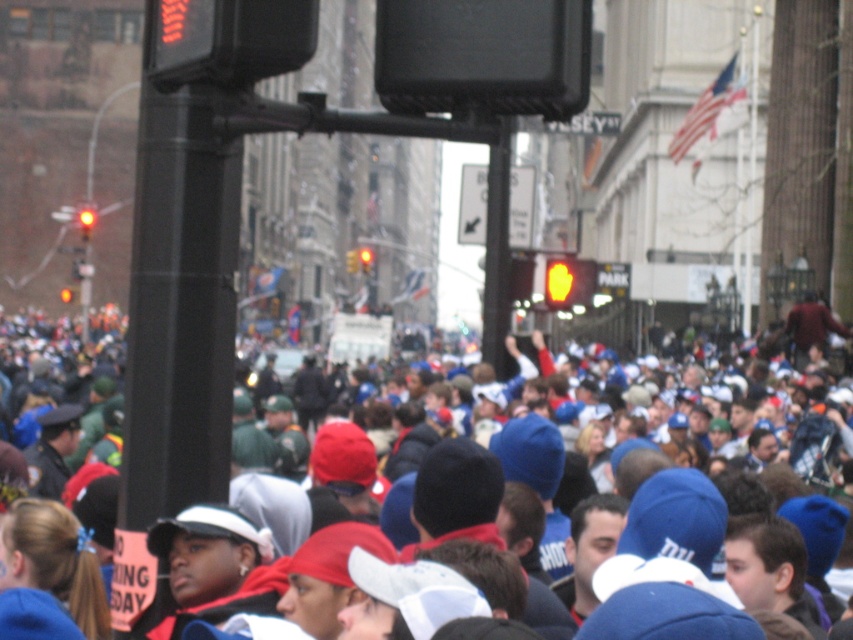
You are a pedestrian standing on the sidewalk and see the blue fabric hats at center and the black metal pole at center. Which object is closer to the ground?

The blue fabric hats at center are closer to the ground because they are located below the black metal pole at center.

You are a photographer trying to capture the crowd in the urban street scene. You notice a point at coordinates (700, 436). Which object from the scene does this point lie on?

The point at coordinates (700, 436) lies on the blue fabric hats at center.